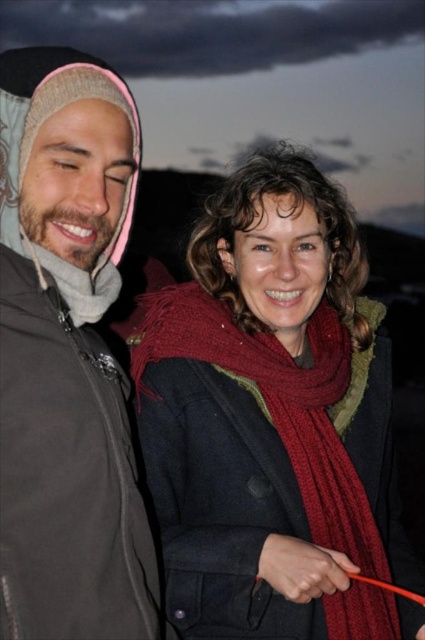
You are a fashion designer observing the two items in the scene. Which item is taller between the matte gray jacket at left and the red knitted scarf at center?

The matte gray jacket at left is taller than the red knitted scarf at center.

You are a photographer trying to capture a candid shot of the two people in the scene. The camera you are using has a minimum focusing distance of 45 centimeters. Based on the scene, can you determine if the matte gray jacket at left and the red knitted scarf at center are within the camera lens focusing range?

The distance between the matte gray jacket at left and the red knitted scarf at center is 50.69 centimeters, which is greater than the camera lens minimum focusing distance of 45 centimeters. Therefore, the camera can focus on both objects as they are within the required range.